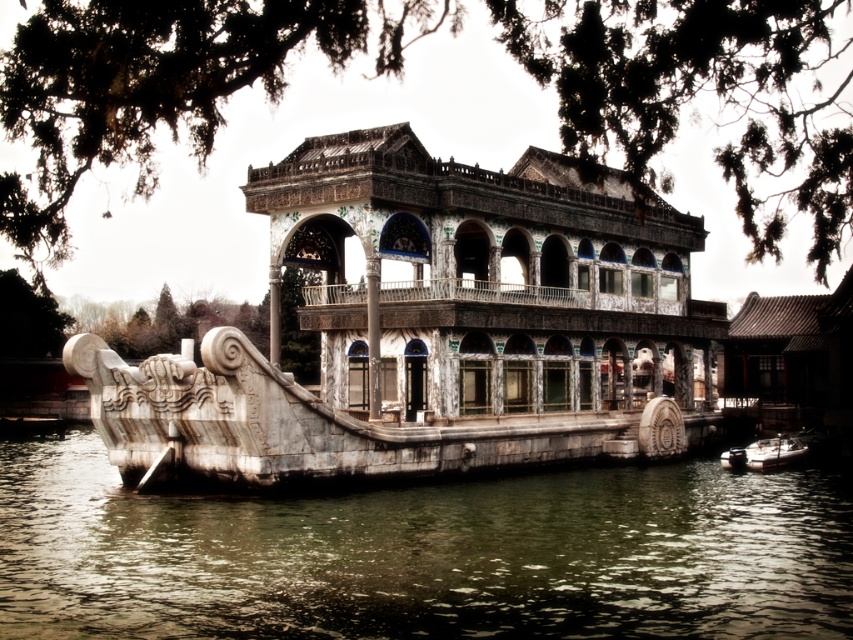
Between greenish water at lower center and metallic silver boat at lower right, which one appears on the right side from the viewer's perspective?

metallic silver boat at lower right is more to the right.

Describe the element at coordinates (424, 554) in the screenshot. This screenshot has width=853, height=640. I see `greenish water at lower center` at that location.

Where is `greenish water at lower center`? This screenshot has width=853, height=640. greenish water at lower center is located at coordinates (424, 554).